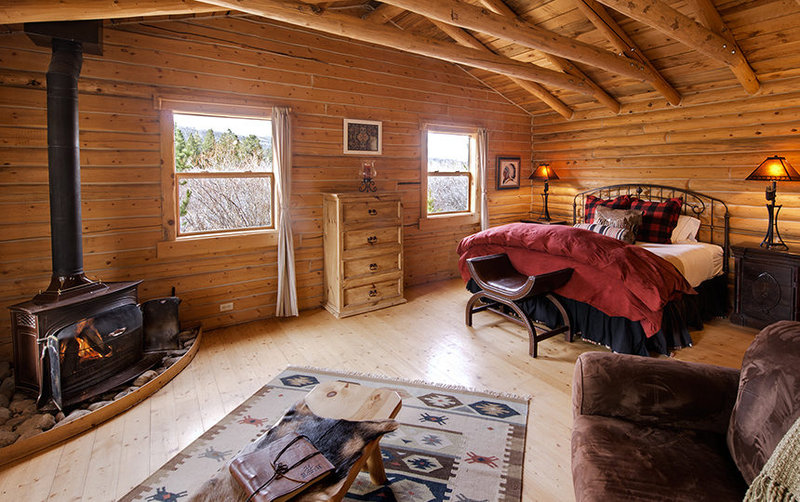
Find the location of a particular element. This screenshot has width=800, height=502. curtains is located at coordinates (288, 273), (482, 176).